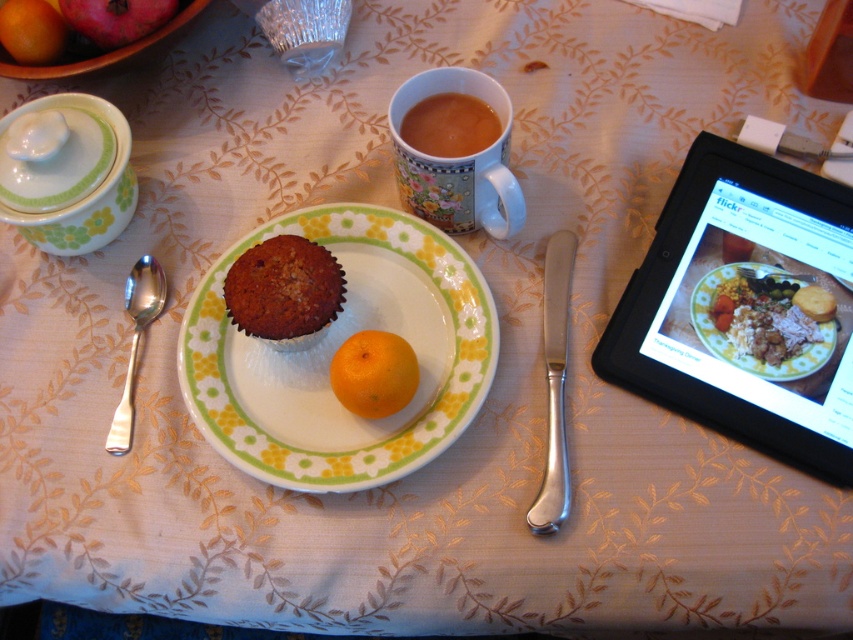
Question: Does orange matte at center have a larger size compared to smooth red apple at upper left?

Choices:
 (A) yes
 (B) no

Answer: (B)

Question: Which of the following is the closest to the observer?

Choices:
 (A) (149, 294)
 (B) (376, 380)
 (C) (753, 276)

Answer: (B)

Question: Can you confirm if smooth brown rice at upper right is positioned to the right of smooth red apple at upper left?

Choices:
 (A) yes
 (B) no

Answer: (A)

Question: Which point is farther to the camera?

Choices:
 (A) (85, 28)
 (B) (335, 298)
 (C) (514, 209)

Answer: (A)

Question: Is matte brown muffin at center closer to the viewer compared to brown ceramic mug at upper center?

Choices:
 (A) no
 (B) yes

Answer: (B)

Question: Which of the following is the farthest from the observer?

Choices:
 (A) (732, 317)
 (B) (552, 275)

Answer: (B)